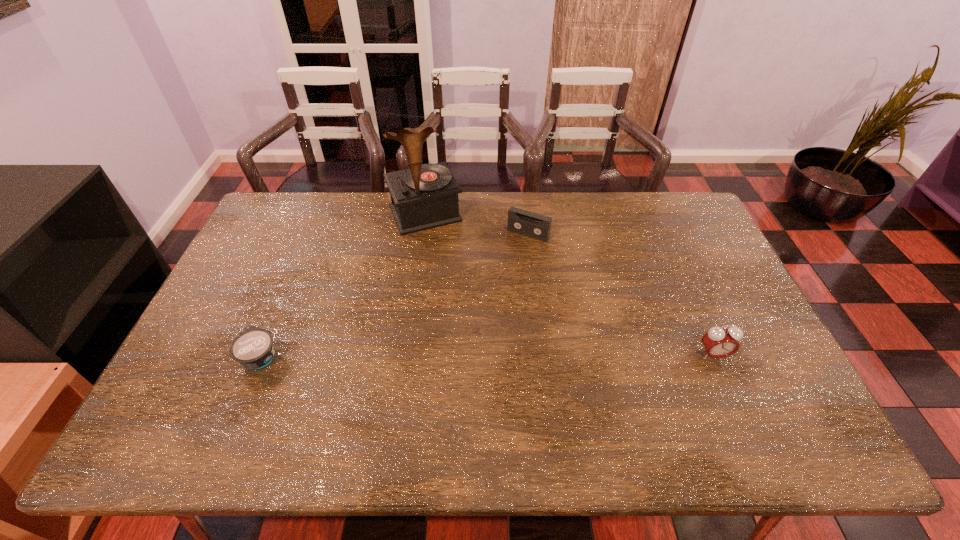
Where is `unoccupied position between the second tallest object and the shortest object`? This screenshot has width=960, height=540. unoccupied position between the second tallest object and the shortest object is located at coordinates (487, 355).

Where is `free space between the leftmost object and the tallest object`? The image size is (960, 540). free space between the leftmost object and the tallest object is located at coordinates pyautogui.click(x=343, y=285).

Locate an element on the screen. The image size is (960, 540). vacant point located between the second shortest object and the third object from right to left is located at coordinates (476, 224).

The width and height of the screenshot is (960, 540). Identify the location of vacant area that lies between the second tallest object and the yogurt. tap(487, 355).

What are the coordinates of `vacant space in between the second shortest object and the shortest object` in the screenshot? It's located at (395, 295).

Identify the location of vacant space that is in between the leftmost object and the third tallest object. Image resolution: width=960 pixels, height=540 pixels. (395, 295).

Select which object is the second closest to the tallest object. Please provide its 2D coordinates. Your answer should be formatted as a tuple, i.e. [(x, y)], where the tuple contains the x and y coordinates of a point satisfying the conditions above.

[(253, 348)]

Point out which object is positioned as the second nearest to the third object from right to left. Please provide its 2D coordinates. Your answer should be formatted as a tuple, i.e. [(x, y)], where the tuple contains the x and y coordinates of a point satisfying the conditions above.

[(253, 348)]

Identify the location of free location that satisfies the following two spatial constraints: 1. on the front side of the phonograph_record; 2. on the left side of the second shortest object. (422, 234).